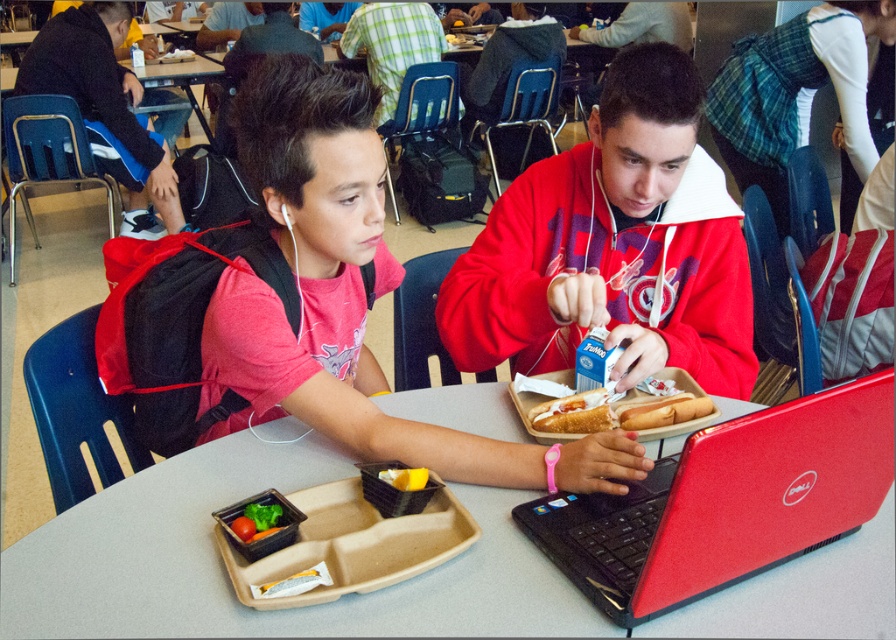
This screenshot has width=896, height=640. Describe the element at coordinates (392, 44) in the screenshot. I see `plaid shirt at upper center` at that location.

At what (x,y) coordinates should I click in order to perform the action: click on plaid shirt at upper center. Please return your answer as a coordinate pair (x, y). Looking at the image, I should click on (x=392, y=44).

Does smooth plastic table at center have a larger size compared to red plastic laptop at center?

Indeed, smooth plastic table at center has a larger size compared to red plastic laptop at center.

The width and height of the screenshot is (896, 640). What do you see at coordinates (228, 579) in the screenshot?
I see `smooth plastic table at center` at bounding box center [228, 579].

Image resolution: width=896 pixels, height=640 pixels. Find the location of `smooth plastic table at center`. smooth plastic table at center is located at coordinates (228, 579).

Can you confirm if red plastic laptop at center is smaller than yellow matte cheese at center?

No.

Is point (649, 529) less distant than point (410, 476)?

Yes, point (649, 529) is closer to viewer.

Who is more distant from viewer, (747, 467) or (395, 472)?

The point (395, 472) is more distant.

Where is `red plastic laptop at center`? red plastic laptop at center is located at coordinates (725, 502).